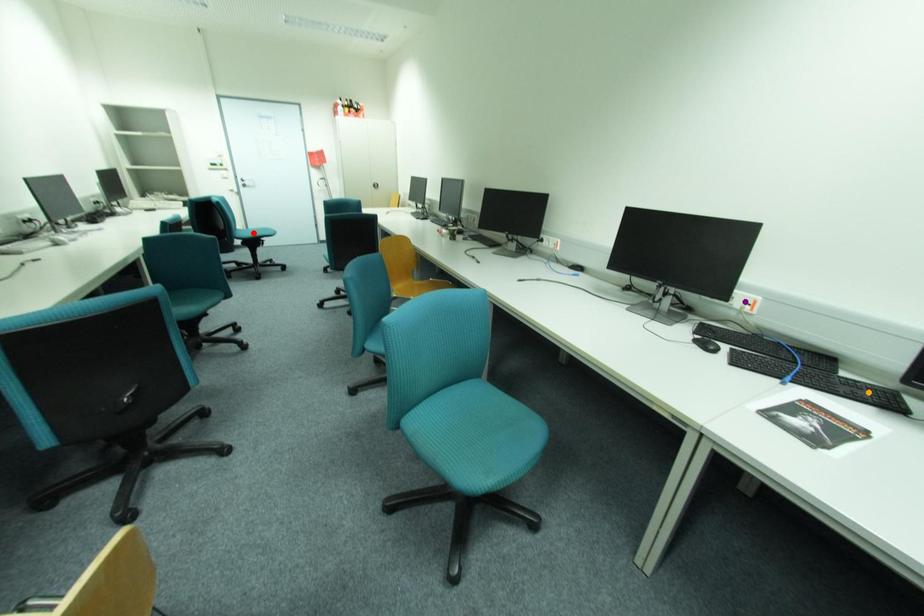
Order these from farthest to nearest:
- purple point
- orange point
- red point

red point, purple point, orange point